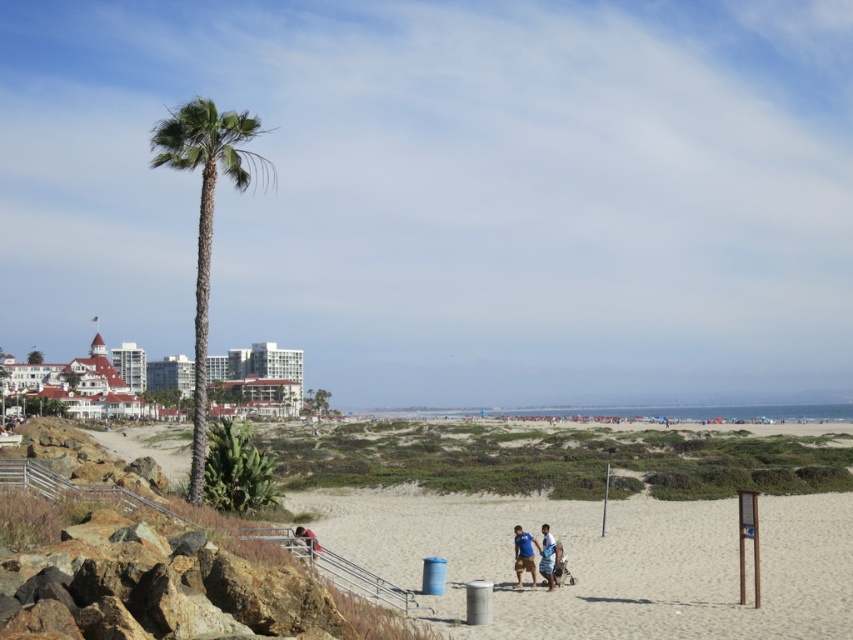
Question: Which object is positioned closest to the blue denim shorts at lower center?

Choices:
 (A) blue cotton shirt at center
 (B) green leafy palm tree at left
 (C) blue striped shorts at center
 (D) light beige sand at center

Answer: (A)

Question: Does green leafy palm tree at left have a lesser width compared to blue cotton shirt at center?

Choices:
 (A) no
 (B) yes

Answer: (A)

Question: Which point is farther from the camera taking this photo?

Choices:
 (A) [628, 584]
 (B) [302, 529]
 (C) [267, 172]

Answer: (C)

Question: Does light beige sand at center have a lesser width compared to blue cotton shirt at center?

Choices:
 (A) yes
 (B) no

Answer: (B)

Question: Which of the following is the farthest from the observer?

Choices:
 (A) light beige sand at center
 (B) blue cotton shirt at center
 (C) blue striped shorts at center
 (D) green leafy palm tree at left

Answer: (D)

Question: Where is blue cotton shirt at center located in relation to blue denim shorts at lower center in the image?

Choices:
 (A) above
 (B) below

Answer: (B)